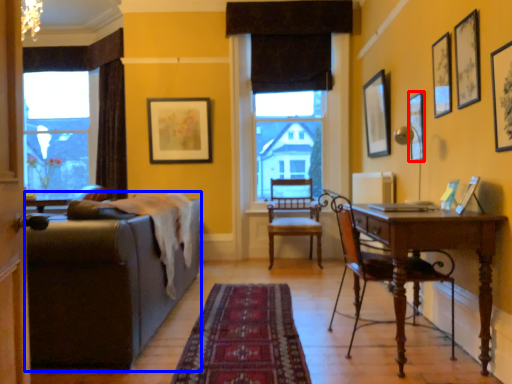
Question: Which object is further to the camera taking this photo, picture frame (highlighted by a red box) or studio couch (highlighted by a blue box)?

Choices:
 (A) picture frame
 (B) studio couch

Answer: (A)